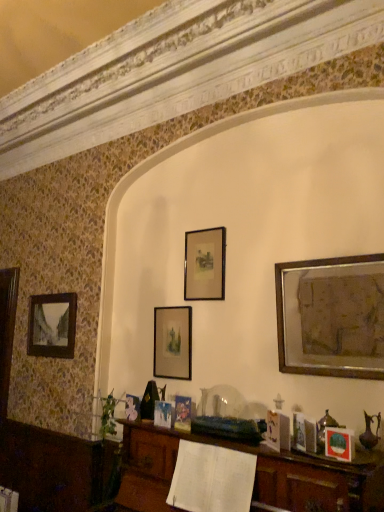
At what (x,y) coordinates should I click in order to perform the action: click on vacant point above gold metallic picture frame at upper right, the second picture frame in the front-to-back sequence (from a real-world perspective). Please return your answer as a coordinate pair (x, y). The width and height of the screenshot is (384, 512). Looking at the image, I should click on (335, 251).